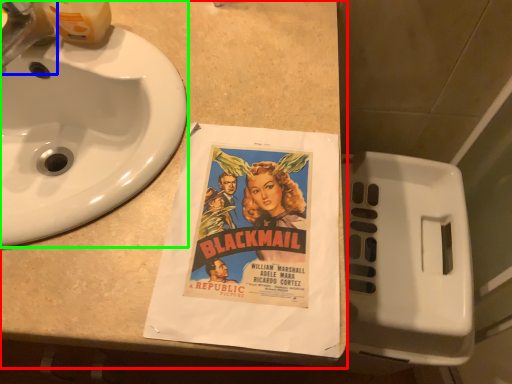
Question: Which object is the farthest from counter top (highlighted by a red box)? Choose among these: faucet (highlighted by a blue box) or sink (highlighted by a green box).

Choices:
 (A) faucet
 (B) sink

Answer: (A)